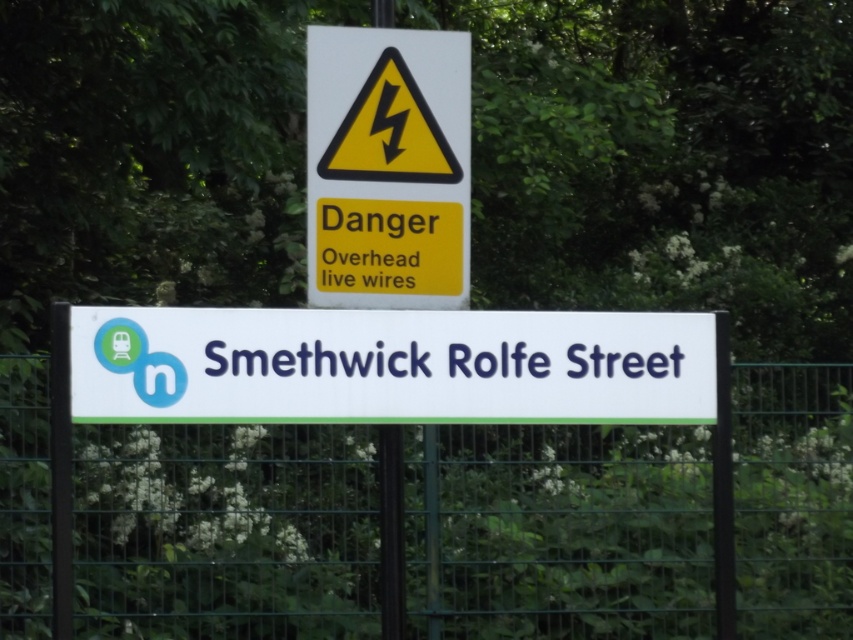
Question: Is green metal fence at lower center above white plastic sign at center?

Choices:
 (A) no
 (B) yes

Answer: (A)

Question: Can you confirm if green metal fence at lower center is positioned to the left of white plastic sign at center?

Choices:
 (A) yes
 (B) no

Answer: (B)

Question: Which point appears farthest from the camera in this image?

Choices:
 (A) (840, 634)
 (B) (80, 387)

Answer: (A)

Question: Which of the following is the closest to the observer?

Choices:
 (A) green metal fence at lower center
 (B) white plastic sign at center

Answer: (B)

Question: Can you confirm if green metal fence at lower center is smaller than white plastic sign at center?

Choices:
 (A) no
 (B) yes

Answer: (A)